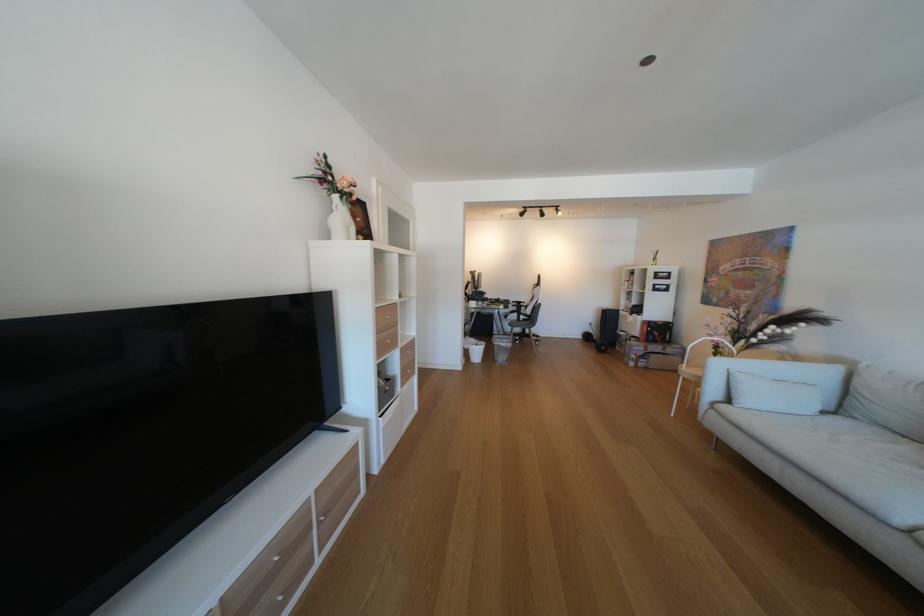
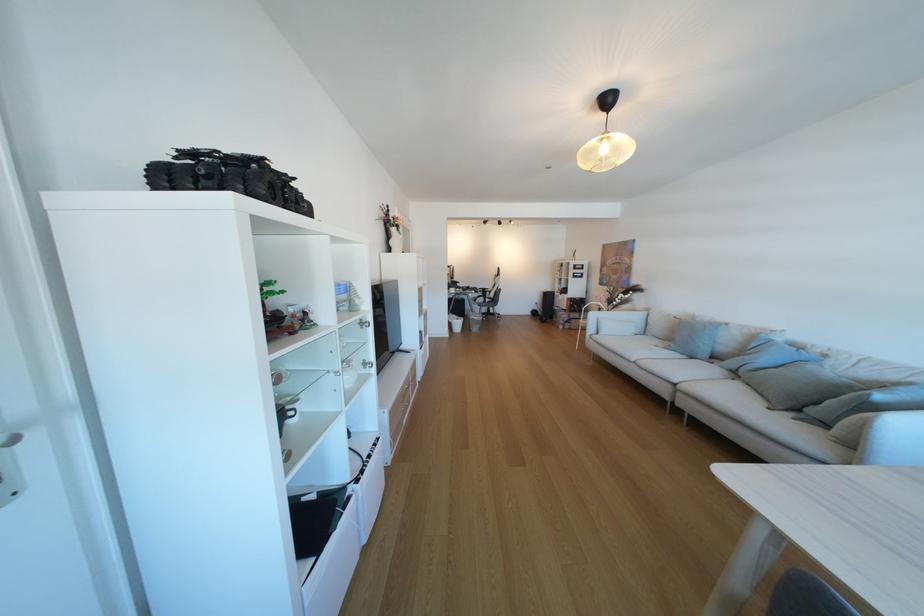
In the second image, find the point that corresponds to (488,346) in the first image.

(468, 321)